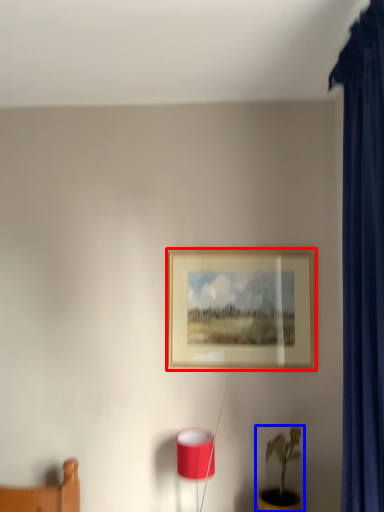
Question: Which object is closer to the camera taking this photo, picture frame (highlighted by a red box) or houseplant (highlighted by a blue box)?

Choices:
 (A) picture frame
 (B) houseplant

Answer: (B)